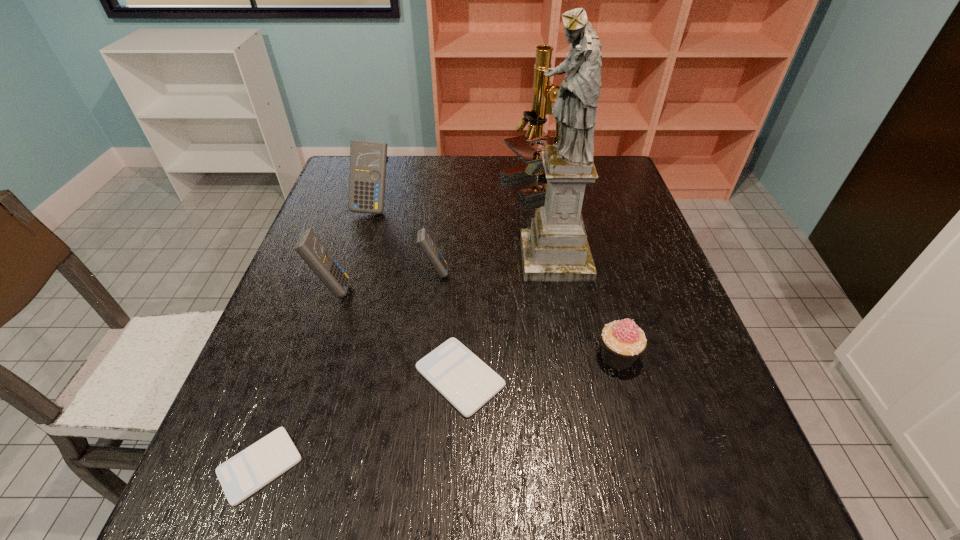
You are a GUI agent. You are given a task and a screenshot of the screen. Output one action in this format:
    pyautogui.click(x=<x>, y=<y>)
    Task: Click on the sculpture
    This screenshot has width=960, height=540.
    Given the screenshot: What is the action you would take?
    pyautogui.click(x=555, y=249)

Where is `gray sculpture`? This screenshot has height=540, width=960. gray sculpture is located at coordinates (555, 249).

Identify the location of the second tallest object. (544, 92).

This screenshot has height=540, width=960. In order to click on gold microscope in this screenshot , I will do `click(544, 92)`.

At what (x,y) coordinates should I click in order to perform the action: click on the third tallest object. Please return your answer as a coordinate pair (x, y). Looking at the image, I should click on (367, 176).

This screenshot has width=960, height=540. Find the location of `the farthest calculator`. the farthest calculator is located at coordinates (367, 176).

Image resolution: width=960 pixels, height=540 pixels. What are the coordinates of `the second tallest calculator` in the screenshot? It's located at (309, 247).

Where is `the fifth shortest object`? This screenshot has height=540, width=960. the fifth shortest object is located at coordinates (309, 247).

The height and width of the screenshot is (540, 960). I want to click on the smallest blue calculator, so click(x=424, y=240).

Where is `the rightmost blue calculator`? The width and height of the screenshot is (960, 540). the rightmost blue calculator is located at coordinates (424, 240).